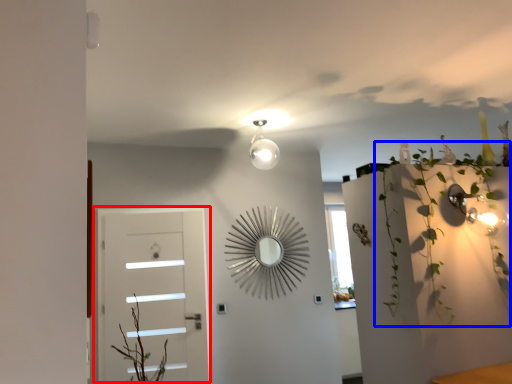
Question: Which point is further to the camera, door (highlighted by a red box) or plant (highlighted by a blue box)?

Choices:
 (A) door
 (B) plant

Answer: (A)